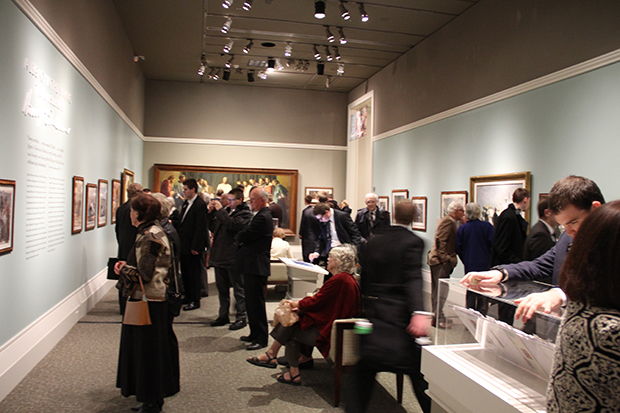
Identify the location of shadows of people on the carpet. (206, 342), (286, 393), (99, 311), (116, 302), (204, 317).